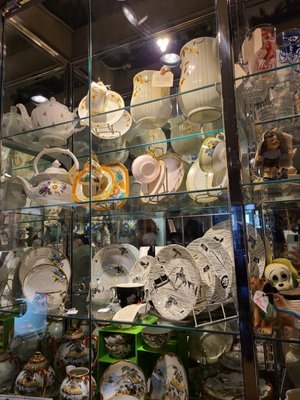
The width and height of the screenshot is (300, 400). In order to click on black and white plate set in this screenshot , I will do `click(188, 294)`, `click(206, 275)`, `click(220, 267)`, `click(226, 243)`, `click(136, 280)`, `click(115, 277)`, `click(130, 247)`.